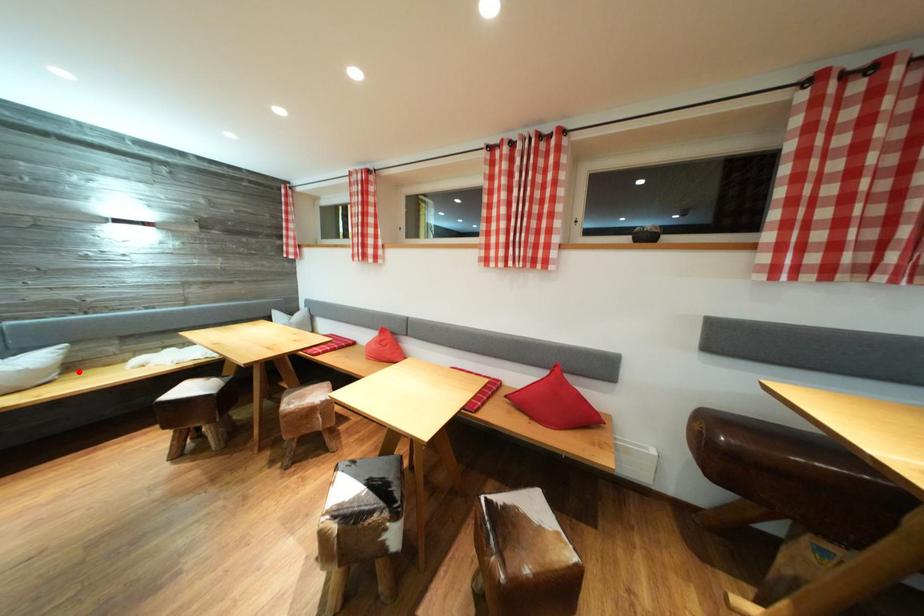
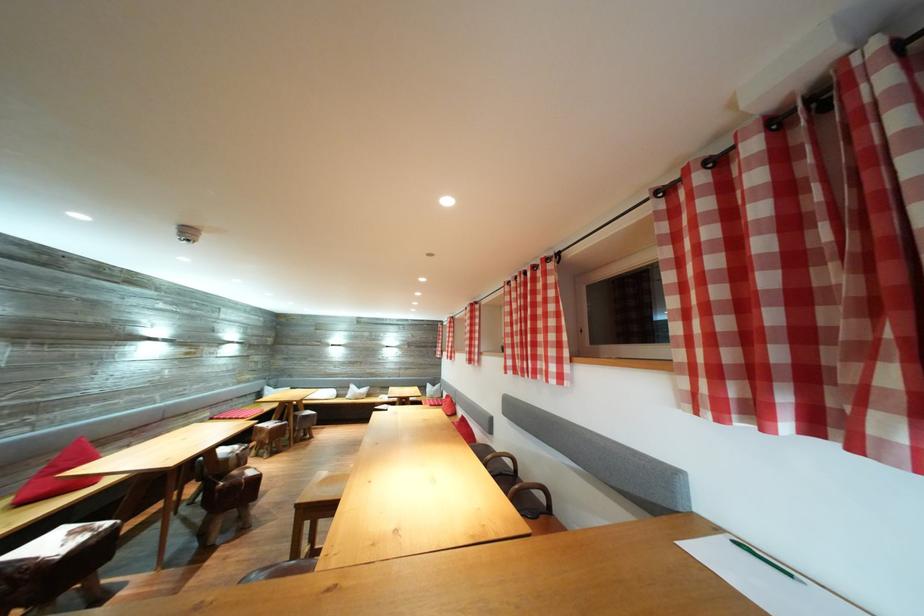
Question: I am providing you with two images of the same scene from different viewpoints. In image1, a red point is highlighted. Considering the same 3D point in image2, which of the following is correct?

Choices:
 (A) It is closer
 (B) It is farther

Answer: (B)